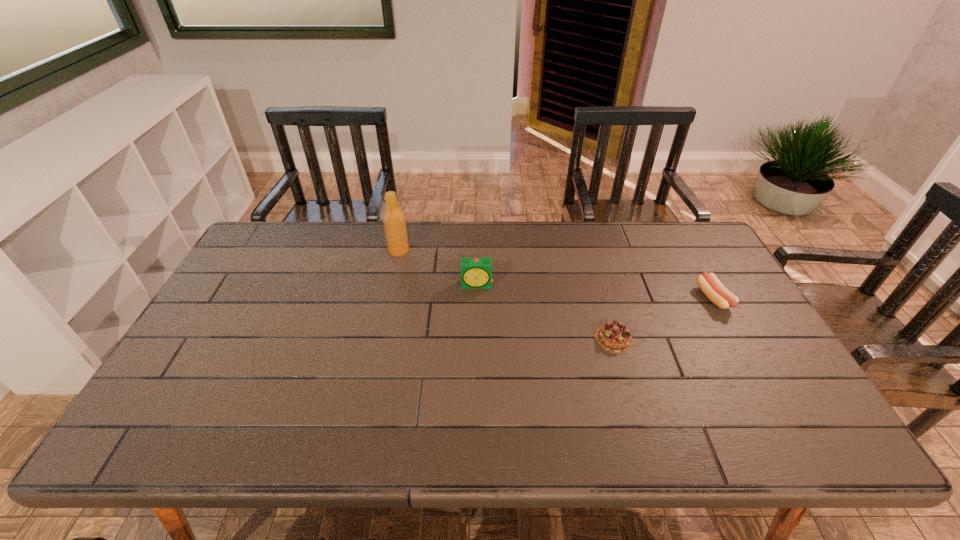
I want to click on free space located 0.350m on the left of the chocolate cake, so click(465, 339).

Where is `object that is at the far edge`? This screenshot has width=960, height=540. object that is at the far edge is located at coordinates (394, 221).

Image resolution: width=960 pixels, height=540 pixels. Identify the location of object present at the right edge. (714, 290).

At what (x,y) coordinates should I click in order to perform the action: click on vacant space at the far edge of the desktop. Please return your answer as a coordinate pair (x, y). Looking at the image, I should click on (505, 261).

Identify the location of vacant space at the near edge of the desktop. (734, 441).

I want to click on vacant space at the left edge, so click(x=211, y=334).

Locate an element on the screen. free space at the right edge is located at coordinates (782, 384).

The image size is (960, 540). In the image, there is a desktop. Identify the location of vacant space at the far left corner. (278, 222).

At what (x,y) coordinates should I click in order to perform the action: click on free space at the near left corner of the desktop. Please return your answer as a coordinate pair (x, y). The image size is (960, 540). Looking at the image, I should click on coord(139,446).

This screenshot has height=540, width=960. What are the coordinates of `free space at the far right corner` in the screenshot? It's located at (684, 230).